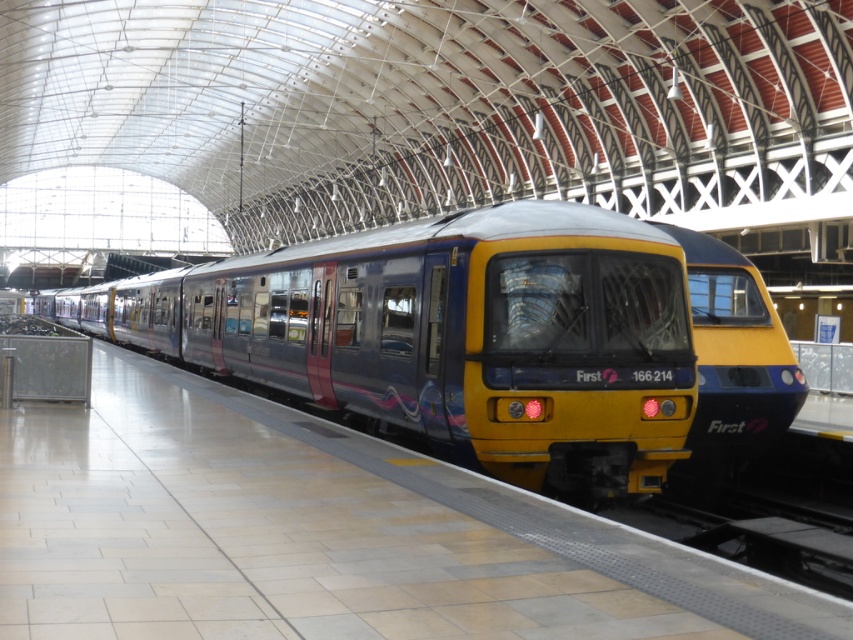
You are a maintenance worker needing to inspect the top of both the metallic blue train at center and the yellow glossy train at center. Which train will require you to use a taller ladder?

The metallic blue train at center has a greater height compared to the yellow glossy train at center, so you will need a taller ladder for the metallic blue train at center.